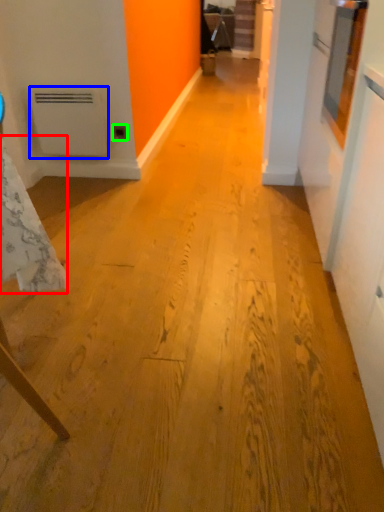
Question: Which object is the farthest from tablecloth (highlighted by a red box)? Choose among these: water heater (highlighted by a blue box) or electric outlet (highlighted by a green box).

Choices:
 (A) water heater
 (B) electric outlet

Answer: (B)